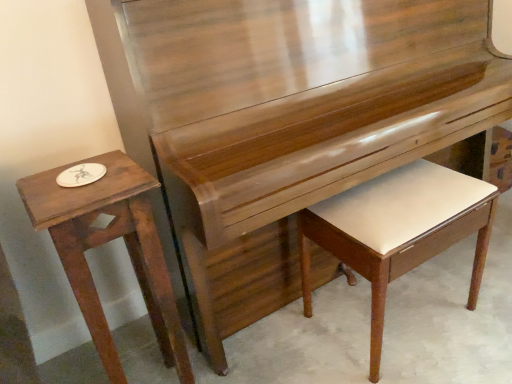
Locate an element on the screen. This screenshot has width=512, height=384. vacant space behind wooden table at left is located at coordinates (134, 341).